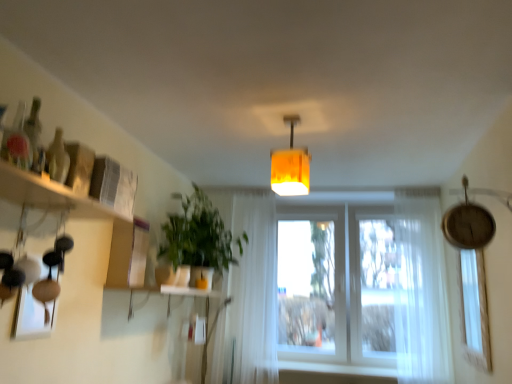
Question: In terms of size, does translucent glass bottle at upper left appear bigger or smaller than white sheer curtain at center, which is counted as the 1th curtain, starting from the left?

Choices:
 (A) small
 (B) big

Answer: (A)

Question: From the image's perspective, is translucent glass bottle at upper left above or below white sheer curtain at center, which appears as the second curtain when viewed from the right?

Choices:
 (A) below
 (B) above

Answer: (B)

Question: Which object is positioned farthest from the white sheer curtain at center, which appears as the second curtain when viewed from the right?

Choices:
 (A) white sheer curtain at right, the 1th curtain when ordered from right to left
 (B) green matte plant at center-left
 (C) wooden shelf at left
 (D) transparent glass window at right
 (E) white matte window sill at lower center

Answer: (D)

Question: Which object is positioned farthest from the green matte plant at center-left?

Choices:
 (A) transparent glass window at right
 (B) white sheer curtain at right, the 1th curtain when ordered from right to left
 (C) white sheer curtain at center, which appears as the second curtain when viewed from the right
 (D) wooden shelf at left
 (E) translucent glass bottle at upper left

Answer: (A)